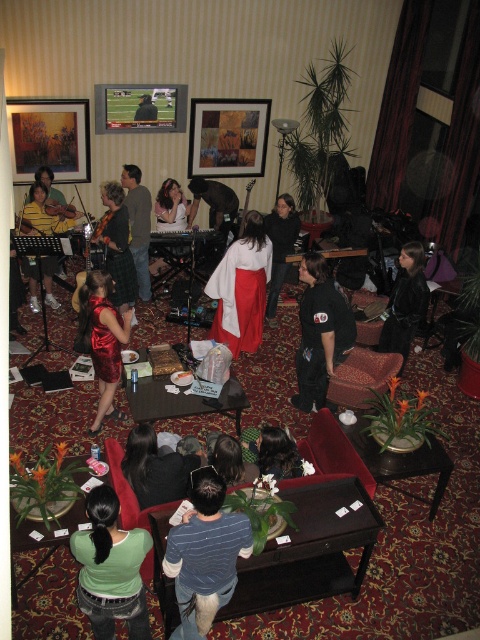
Question: Which object appears closest to the camera in this image?

Choices:
 (A) matte black guitar at left
 (B) dark hair at center
 (C) wooden drum at center
 (D) shiny red dress at center

Answer: (B)

Question: Is blue striped shirt at center smaller than matte black guitar at left?

Choices:
 (A) no
 (B) yes

Answer: (B)

Question: Does matte black kimono at center come in front of dark blue shirt at center?

Choices:
 (A) no
 (B) yes

Answer: (A)

Question: In this image, where is matte black kimono at center located relative to matte black guitar at center?

Choices:
 (A) left
 (B) right

Answer: (B)

Question: Which object is positioned closest to the matte black guitar at center?

Choices:
 (A) shiny black dress at center
 (B) dark gray shirt at center
 (C) blue striped shirt at center
 (D) white satin dress at center

Answer: (D)

Question: Which point is farther to the camera?

Choices:
 (A) (108, 605)
 (B) (143, 240)
 (C) (177, 182)

Answer: (C)